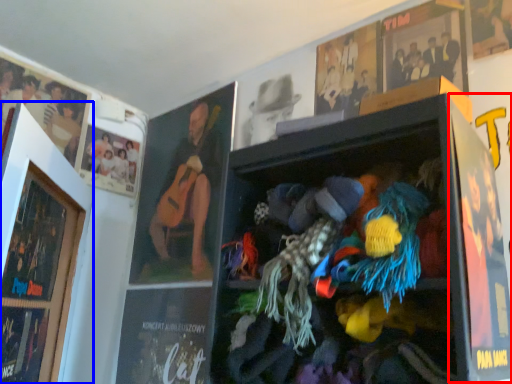
Question: Which of the following is the closest to the observer, poster page (highlighted by a red box) or picture frame (highlighted by a blue box)?

Choices:
 (A) poster page
 (B) picture frame

Answer: (A)